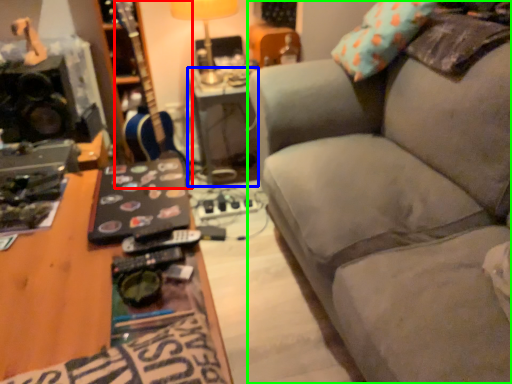
Question: Which object is the farthest from guitar (highlighted by a red box)? Choose among these: table (highlighted by a blue box) or studio couch (highlighted by a green box).

Choices:
 (A) table
 (B) studio couch

Answer: (B)